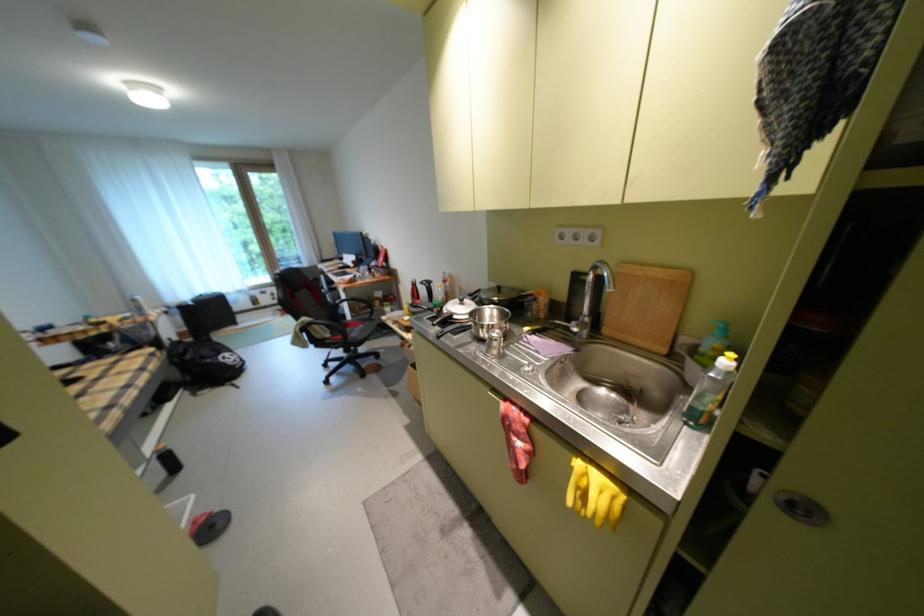
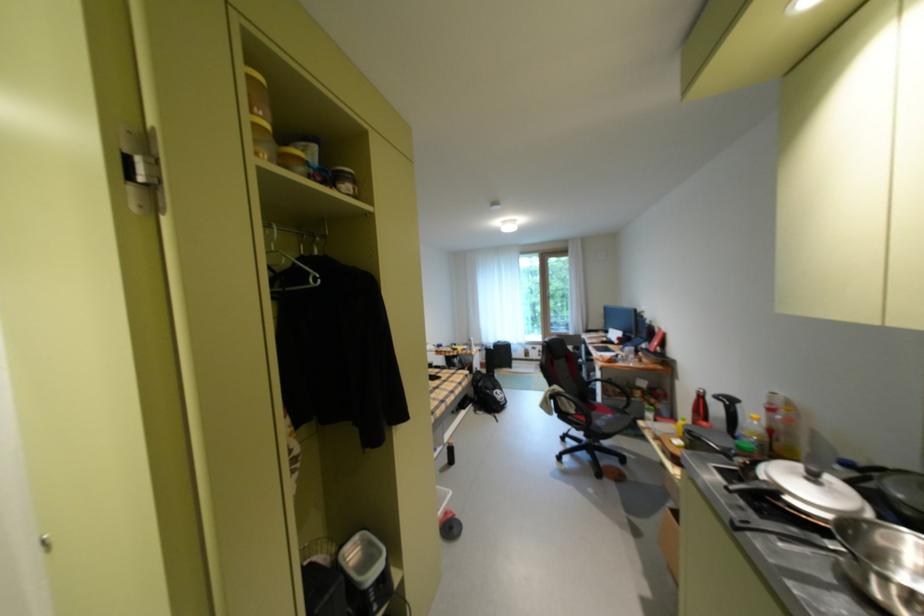
Question: The images are taken continuously from a first-person perspective. In which direction is your viewpoint rotating?

Choices:
 (A) Left
 (B) Right
 (C) Up
 (D) Down

Answer: (A)